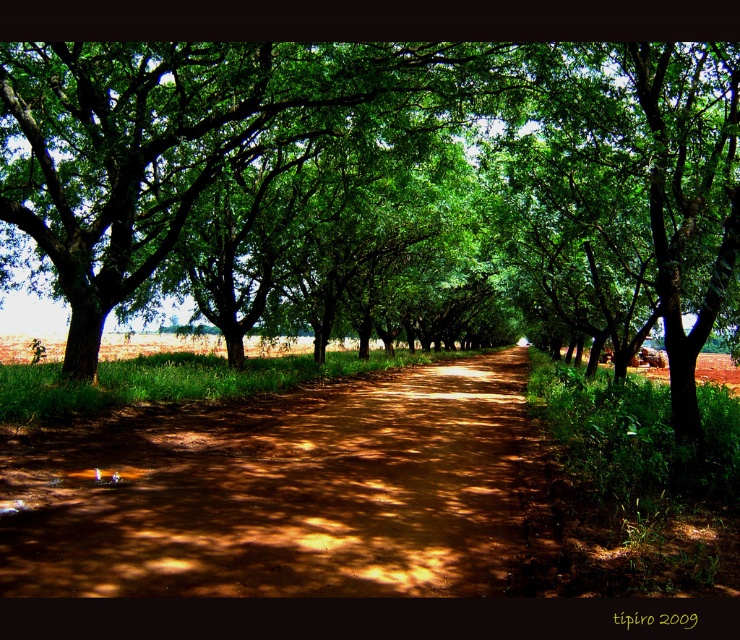
Question: Is green leafy tree at center wider than brown dirt track at center?

Choices:
 (A) yes
 (B) no

Answer: (A)

Question: Is green leafy tree at center wider than brown dirt track at center?

Choices:
 (A) no
 (B) yes

Answer: (B)

Question: Is green leafy tree at center to the right of brown dirt track at center from the viewer's perspective?

Choices:
 (A) no
 (B) yes

Answer: (B)

Question: Which object is farther from the camera taking this photo?

Choices:
 (A) brown dirt track at center
 (B) green leafy tree at center

Answer: (B)

Question: Among these objects, which one is nearest to the camera?

Choices:
 (A) green leafy tree at center
 (B) brown dirt track at center

Answer: (B)